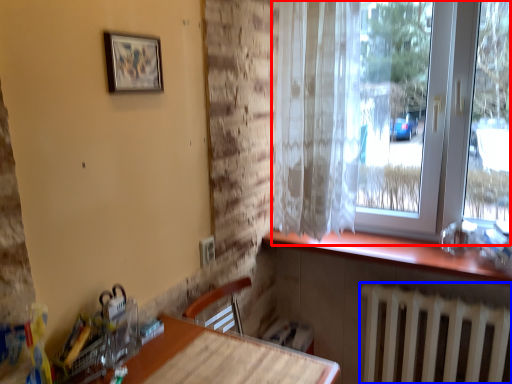
Question: Which point is further to the camera, window (highlighted by a red box) or radiator (highlighted by a blue box)?

Choices:
 (A) window
 (B) radiator

Answer: (B)